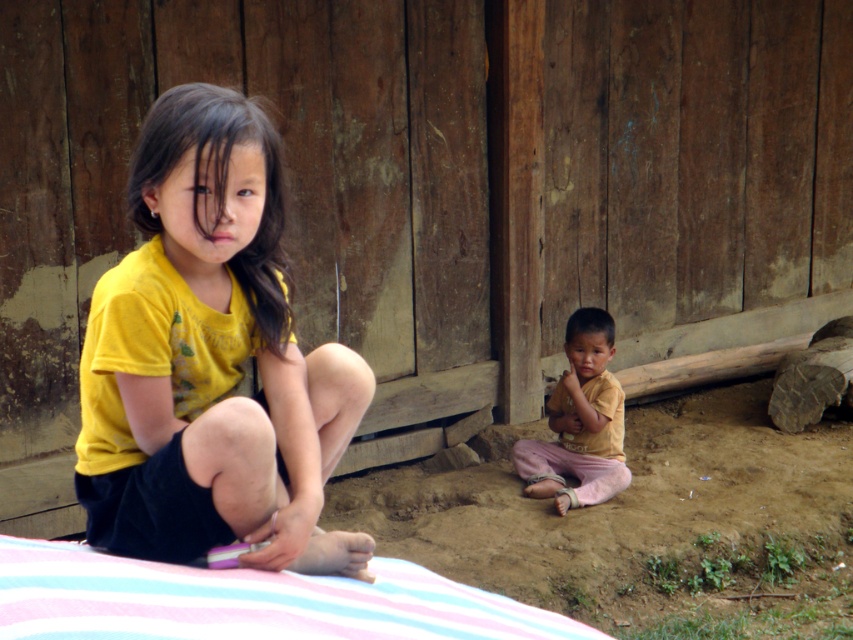
You are a photographer trying to capture a photo of both the yellow matte shirt at left and the yellow cotton shirt at lower right in the scene. Which shirt should you focus on first if you want to include both in your shot without moving the camera?

The yellow matte shirt at left is positioned on the left side of the yellow cotton shirt at lower right, so you should focus on the yellow cotton shirt at lower right first to ensure both are in frame.

You are standing in the rustic outdoor scene with weathered wooden walls. You notice a point marked at coordinates [247,600]. What object is located at that point?

The point at coordinates [247,600] corresponds to the pink striped fabric at lower left.